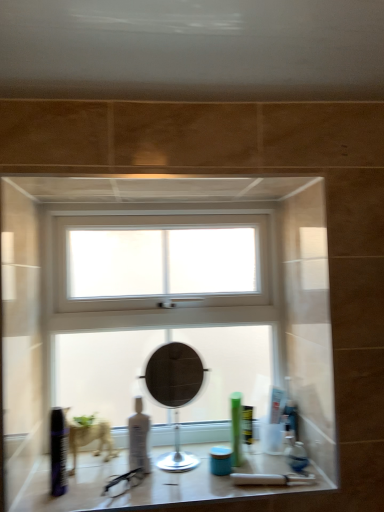
Question: Is green matte tube at center, the fourth toiletry in the left-to-right sequence, smaller than matte glass counter top at center?

Choices:
 (A) no
 (B) yes

Answer: (B)

Question: Could you tell me if green matte tube at center, the fourth toiletry in the left-to-right sequence, is turned towards matte glass counter top at center?

Choices:
 (A) no
 (B) yes

Answer: (A)

Question: Is green matte tube at center, the first toiletry when ordered from right to left, to the right of matte glass counter top at center from the viewer's perspective?

Choices:
 (A) no
 (B) yes

Answer: (B)

Question: Can we say green matte tube at center, the fourth toiletry in the left-to-right sequence, lies outside matte glass counter top at center?

Choices:
 (A) no
 (B) yes

Answer: (B)

Question: Does green matte tube at center, the first toiletry when ordered from right to left, have a larger size compared to matte glass counter top at center?

Choices:
 (A) yes
 (B) no

Answer: (B)

Question: Is green matte tube at center, the first toiletry when ordered from right to left, thinner than matte glass counter top at center?

Choices:
 (A) yes
 (B) no

Answer: (A)

Question: Does shiny black can at lower left, positioned as the first toiletry in left-to-right order, turn towards blue matte jar at center, the third toiletry from the left?

Choices:
 (A) yes
 (B) no

Answer: (B)

Question: Does shiny black can at lower left, positioned as the first toiletry in left-to-right order, have a larger size compared to blue matte jar at center, the third toiletry from the left?

Choices:
 (A) no
 (B) yes

Answer: (B)

Question: Does shiny black can at lower left, marked as the 4th toiletry in a right-to-left arrangement, have a lesser width compared to blue matte jar at center, which is the second toiletry from right to left?

Choices:
 (A) yes
 (B) no

Answer: (A)

Question: Is the surface of shiny black can at lower left, marked as the 4th toiletry in a right-to-left arrangement, in direct contact with blue matte jar at center, which is the second toiletry from right to left?

Choices:
 (A) yes
 (B) no

Answer: (B)

Question: Is blue matte jar at center, which is the second toiletry from right to left, surrounded by shiny black can at lower left, positioned as the first toiletry in left-to-right order?

Choices:
 (A) yes
 (B) no

Answer: (B)

Question: From a real-world perspective, is shiny black can at lower left, positioned as the first toiletry in left-to-right order, physically below blue matte jar at center, which is the second toiletry from right to left?

Choices:
 (A) yes
 (B) no

Answer: (B)

Question: From a real-world perspective, is blue matte jar at center, the third toiletry from the left, positioned under green matte tube at center, the fourth toiletry in the left-to-right sequence, based on gravity?

Choices:
 (A) yes
 (B) no

Answer: (A)